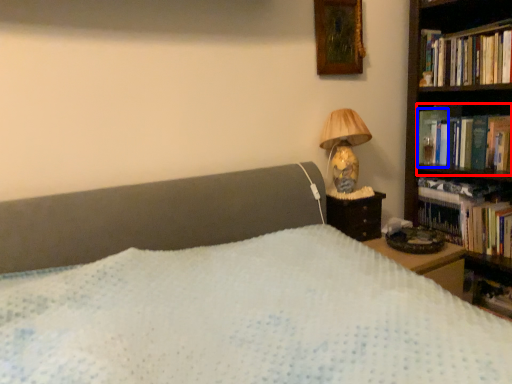
Question: Which point is further to the camera, book (highlighted by a red box) or paperback book (highlighted by a blue box)?

Choices:
 (A) book
 (B) paperback book

Answer: (B)